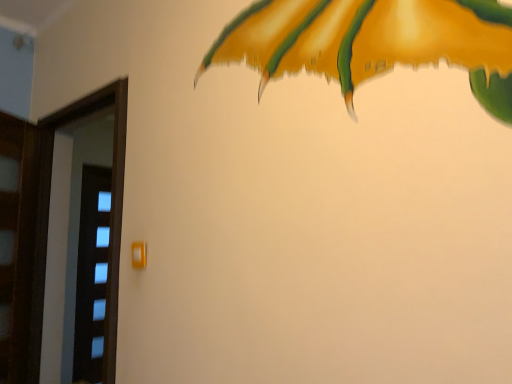
What do you see at coordinates (111, 213) in the screenshot? I see `transparent glass screen door at left` at bounding box center [111, 213].

Where is `transparent glass screen door at left`? The height and width of the screenshot is (384, 512). transparent glass screen door at left is located at coordinates (111, 213).

Locate an element on the screen. This screenshot has height=384, width=512. matte orange door handle at center is located at coordinates (138, 254).

Describe the element at coordinates (138, 254) in the screenshot. I see `matte orange door handle at center` at that location.

You are a GUI agent. You are given a task and a screenshot of the screen. Output one action in this format:
    pyautogui.click(x=<x>, y=<y>)
    Task: Click on the transparent glass screen door at left
    The width and height of the screenshot is (512, 384).
    Given the screenshot: What is the action you would take?
    pyautogui.click(x=111, y=213)

From the picture: Between transparent glass screen door at left and matte orange door handle at center, which one appears on the left side from the viewer's perspective?

Positioned to the left is transparent glass screen door at left.

Is transparent glass screen door at left closer to the viewer compared to matte orange door handle at center?

No, transparent glass screen door at left is further to the viewer.

Which point is more distant from viewer, (117, 311) or (141, 242)?

Point (117, 311)

From the image's perspective, does transparent glass screen door at left appear lower than matte orange door handle at center?

Indeed, from the image's perspective, transparent glass screen door at left is shown beneath matte orange door handle at center.

From a real-world perspective, is transparent glass screen door at left above or below matte orange door handle at center?

transparent glass screen door at left is below matte orange door handle at center.

Which of these two, transparent glass screen door at left or matte orange door handle at center, is thinner?

Thinner between the two is matte orange door handle at center.

Which of these two, transparent glass screen door at left or matte orange door handle at center, stands taller?

transparent glass screen door at left is taller.

Is transparent glass screen door at left smaller than matte orange door handle at center?

No, transparent glass screen door at left is not smaller than matte orange door handle at center.

Is transparent glass screen door at left inside or outside of matte orange door handle at center?

transparent glass screen door at left cannot be found inside matte orange door handle at center.

Is transparent glass screen door at left with matte orange door handle at center?

No, transparent glass screen door at left is not beside matte orange door handle at center.

Is transparent glass screen door at left turned away from matte orange door handle at center?

transparent glass screen door at left is not turned away from matte orange door handle at center.

How many degrees apart are the facing directions of transparent glass screen door at left and matte orange door handle at center?

transparent glass screen door at left and matte orange door handle at center are facing 0.00772 degrees away from each other.

Image resolution: width=512 pixels, height=384 pixels. Identify the location of door handle that is in front of the transparent glass screen door at left. tap(138, 254).

In the scene shown: Is matte orange door handle at center at the left side of transparent glass screen door at left?

Incorrect, matte orange door handle at center is not on the left side of transparent glass screen door at left.

In the image, is matte orange door handle at center positioned in front of or behind transparent glass screen door at left?

Visually, matte orange door handle at center is located in front of transparent glass screen door at left.

Considering the points (140, 266) and (122, 135), which point is in front, point (140, 266) or point (122, 135)?

Positioned in front is point (140, 266).

From the image's perspective, which is above, matte orange door handle at center or transparent glass screen door at left?

matte orange door handle at center, from the image's perspective.

From a real-world perspective, which object stands above the other?

In real-world perspective, matte orange door handle at center is above.

Is matte orange door handle at center thinner than transparent glass screen door at left?

Indeed, matte orange door handle at center has a lesser width compared to transparent glass screen door at left.

Between matte orange door handle at center and transparent glass screen door at left, which one has less height?

matte orange door handle at center is shorter.

In terms of size, does matte orange door handle at center appear bigger or smaller than transparent glass screen door at left?

In the image, matte orange door handle at center appears to be smaller than transparent glass screen door at left.

In the scene shown: Is matte orange door handle at center situated inside transparent glass screen door at left or outside?

matte orange door handle at center cannot be found inside transparent glass screen door at left.

Would you consider matte orange door handle at center to be distant from transparent glass screen door at left?

matte orange door handle at center is near transparent glass screen door at left, not far away.

Is matte orange door handle at center positioned with its back to transparent glass screen door at left?

No, matte orange door handle at center is not facing away from transparent glass screen door at left.

Locate an element on the screen. The image size is (512, 384). screen door on the left of matte orange door handle at center is located at coordinates (111, 213).

This screenshot has width=512, height=384. I want to click on screen door located below the matte orange door handle at center (from the image's perspective), so click(x=111, y=213).

You are a GUI agent. You are given a task and a screenshot of the screen. Output one action in this format:
    pyautogui.click(x=<x>, y=<y>)
    Task: Click on the door handle in front of the transparent glass screen door at left
    
    Given the screenshot: What is the action you would take?
    pyautogui.click(x=138, y=254)